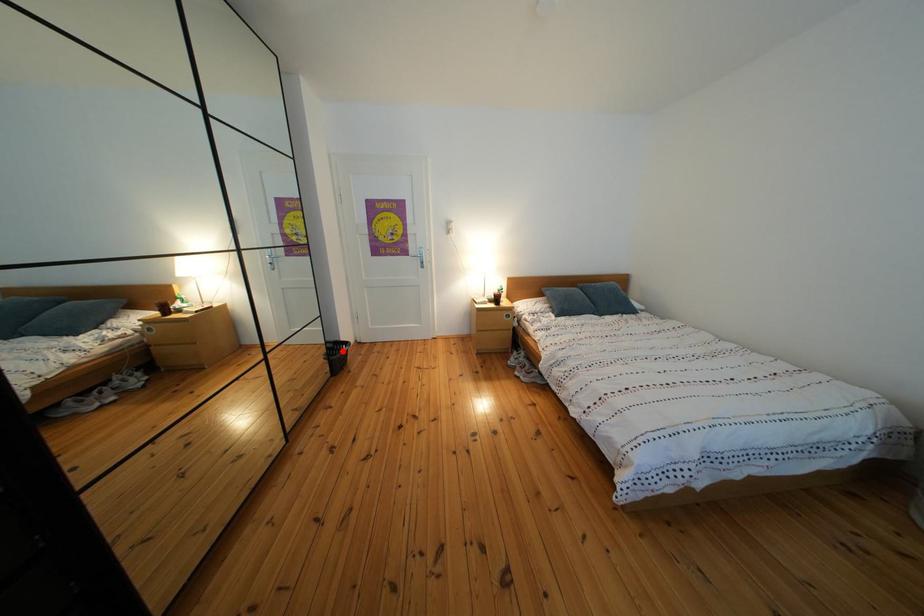
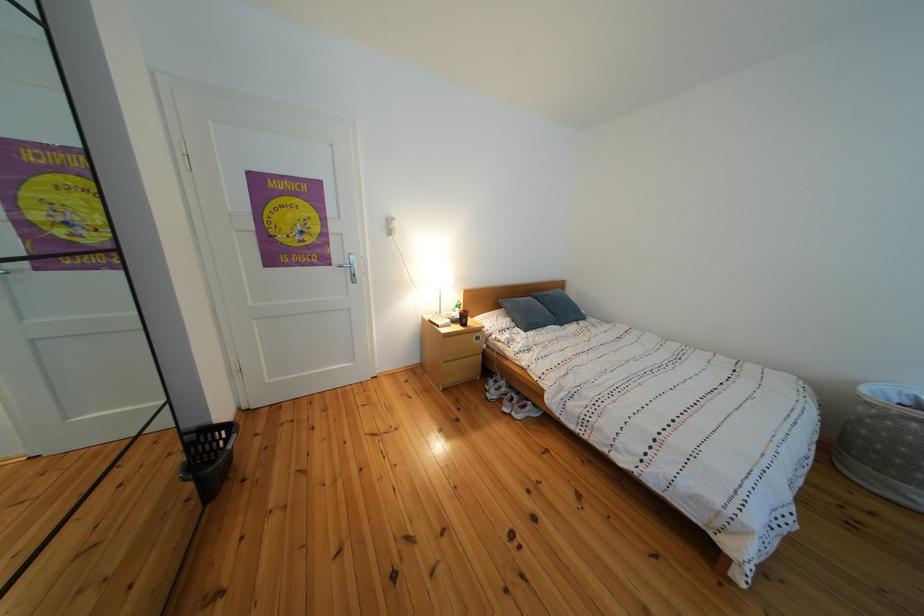
Where in the second image is the point corresponding to the highlighted location from the first image?

(201, 444)